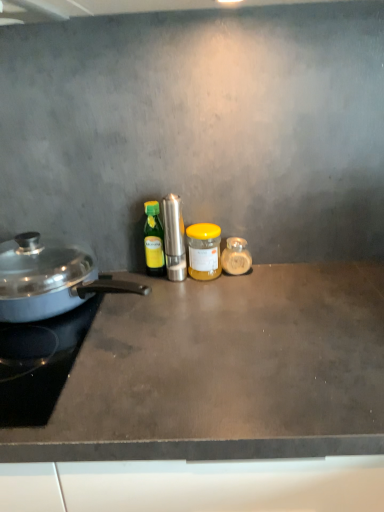
Where is `vacant space in front of yellow matte jar at center, the fourth kitchen appliance viewed from the left`? vacant space in front of yellow matte jar at center, the fourth kitchen appliance viewed from the left is located at coordinates pyautogui.click(x=208, y=305).